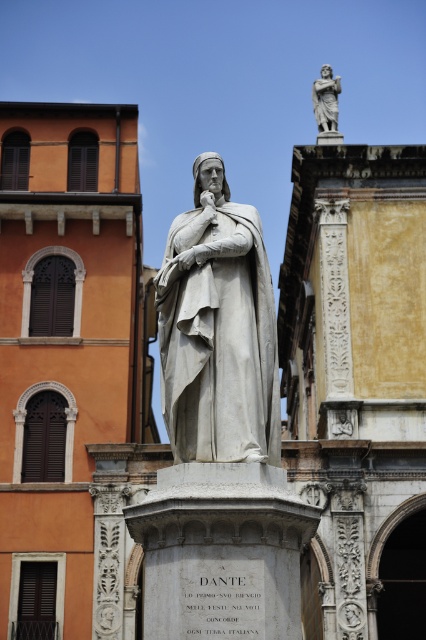
Question: Which object is closer to the camera taking this photo?

Choices:
 (A) white marble statue at center
 (B) polished marble statue at upper center

Answer: (A)

Question: Among these points, which one is farthest from the camera?

Choices:
 (A) 204,358
 (B) 328,113

Answer: (B)

Question: Which object appears closest to the camera in this image?

Choices:
 (A) polished marble statue at upper center
 (B) white marble statue at center

Answer: (B)

Question: Where is white marble statue at center located in relation to polished marble statue at upper center in the image?

Choices:
 (A) below
 (B) above

Answer: (A)

Question: Is white marble statue at center smaller than polished marble statue at upper center?

Choices:
 (A) no
 (B) yes

Answer: (B)

Question: Does white marble statue at center have a greater width compared to polished marble statue at upper center?

Choices:
 (A) yes
 (B) no

Answer: (B)